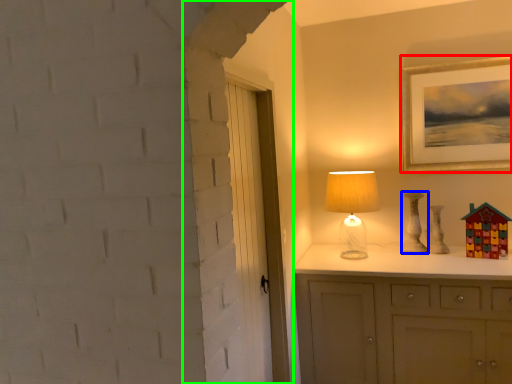
Question: Based on their relative distances, which object is farther from picture frame (highlighted by a red box)? Choose from lamp (highlighted by a blue box) and door (highlighted by a green box).

Choices:
 (A) lamp
 (B) door

Answer: (B)